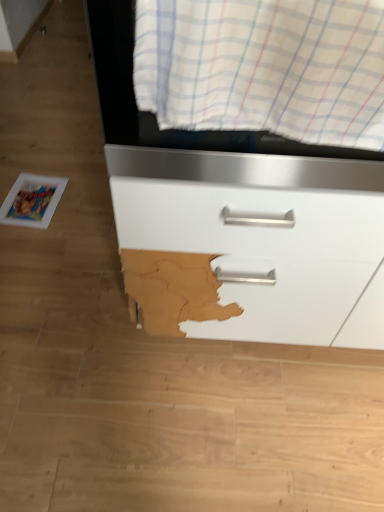
Image resolution: width=384 pixels, height=512 pixels. What do you see at coordinates (32, 201) in the screenshot? I see `white glossy magazine at lower left` at bounding box center [32, 201].

Find the location of a particular element. The width and height of the screenshot is (384, 512). white glossy magazine at lower left is located at coordinates (32, 201).

Locate an element on the screen. This screenshot has height=512, width=384. matte white drawer at center is located at coordinates click(237, 219).

Is white striped fabric at upper center not close to matte white drawer at center?

No.

Looking at this image, from a real-world perspective, is white striped fabric at upper center physically located above or below matte white drawer at center?

white striped fabric at upper center is above matte white drawer at center.

From the image's perspective, is white striped fabric at upper center located beneath matte white drawer at center?

No, from the image's perspective, white striped fabric at upper center is not below matte white drawer at center.

Does white striped fabric at upper center have a lesser width compared to matte white drawer at center?

Indeed, white striped fabric at upper center has a lesser width compared to matte white drawer at center.

From a real-world perspective, which object rests below the other?

white glossy magazine at lower left.

Considering the sizes of objects white striped fabric at upper center and white glossy magazine at lower left in the image provided, who is smaller, white striped fabric at upper center or white glossy magazine at lower left?

white glossy magazine at lower left is smaller.

Does white striped fabric at upper center contain white glossy magazine at lower left?

No.

From the image's perspective, would you say white striped fabric at upper center is positioned over white glossy magazine at lower left?

Yes.

Measure the distance between white glossy magazine at lower left and matte white drawer at center.

A distance of 38.11 inches exists between white glossy magazine at lower left and matte white drawer at center.

From the picture: Would you consider white glossy magazine at lower left to be distant from matte white drawer at center?

They are positioned close to each other.

Could you tell me if white glossy magazine at lower left is facing matte white drawer at center?

No, white glossy magazine at lower left is not turned towards matte white drawer at center.

Where is `magazine on the left side of matte white drawer at center`? magazine on the left side of matte white drawer at center is located at coordinates (32, 201).

Would you consider white glossy magazine at lower left to be distant from white striped fabric at upper center?

Yes, white glossy magazine at lower left and white striped fabric at upper center are quite far apart.

From the picture: Relative to white striped fabric at upper center, is white glossy magazine at lower left in front or behind?

white glossy magazine at lower left is positioned farther from the viewer than white striped fabric at upper center.

Considering the sizes of objects white glossy magazine at lower left and white striped fabric at upper center in the image provided, who is smaller, white glossy magazine at lower left or white striped fabric at upper center?

white glossy magazine at lower left.

Considering the positions of points (22, 218) and (339, 32), is point (22, 218) farther from camera compared to point (339, 32)?

Yes, it is behind point (339, 32).

From the image's perspective, which one is positioned higher, matte white drawer at center or white glossy magazine at lower left?

white glossy magazine at lower left appears higher in the image.

Is matte white drawer at center situated inside white glossy magazine at lower left or outside?

matte white drawer at center is not inside white glossy magazine at lower left, it's outside.

From a real-world perspective, is matte white drawer at center located beneath white glossy magazine at lower left?

No, from a real-world perspective, matte white drawer at center is not below white glossy magazine at lower left.

Identify the location of the chest of drawers located below the white glossy magazine at lower left (from the image's perspective). The width and height of the screenshot is (384, 512). (237, 219).

Do you think matte white drawer at center is within white striped fabric at upper center, or outside of it?

matte white drawer at center cannot be found inside white striped fabric at upper center.

Who is smaller, matte white drawer at center or white striped fabric at upper center?

white striped fabric at upper center is smaller.

Which is less distant, (317, 148) or (376, 2)?

The point (376, 2) is closer to the camera.

The height and width of the screenshot is (512, 384). What are the coordinates of `curtain above the matte white drawer at center (from a real-world perspective)` in the screenshot? It's located at (264, 67).

What are the coordinates of `curtain located in front of the white glossy magazine at lower left` in the screenshot? It's located at (264, 67).

When comparing their distances from white striped fabric at upper center, does white glossy magazine at lower left or matte white drawer at center seem further?

white glossy magazine at lower left is positioned further to the anchor white striped fabric at upper center.

Looking at this image, looking at the image, which one is located closer to matte white drawer at center, white striped fabric at upper center or white glossy magazine at lower left?

Among the two, white striped fabric at upper center is located nearer to matte white drawer at center.

Considering their positions, is white striped fabric at upper center positioned closer to white glossy magazine at lower left than matte white drawer at center?

Among the two, matte white drawer at center is located nearer to white glossy magazine at lower left.

When comparing their distances from white striped fabric at upper center, does matte white drawer at center or white glossy magazine at lower left seem closer?

Based on the image, matte white drawer at center appears to be nearer to white striped fabric at upper center.

Which object lies further to the anchor point white glossy magazine at lower left, matte white drawer at center or white striped fabric at upper center?

white striped fabric at upper center lies further to white glossy magazine at lower left than the other object.

In the scene shown: When comparing their distances from matte white drawer at center, does white glossy magazine at lower left or white striped fabric at upper center seem further?

Among the two, white glossy magazine at lower left is located further to matte white drawer at center.

Where is `chest of drawers between white striped fabric at upper center and white glossy magazine at lower left along the z-axis`? This screenshot has width=384, height=512. chest of drawers between white striped fabric at upper center and white glossy magazine at lower left along the z-axis is located at coordinates (237, 219).